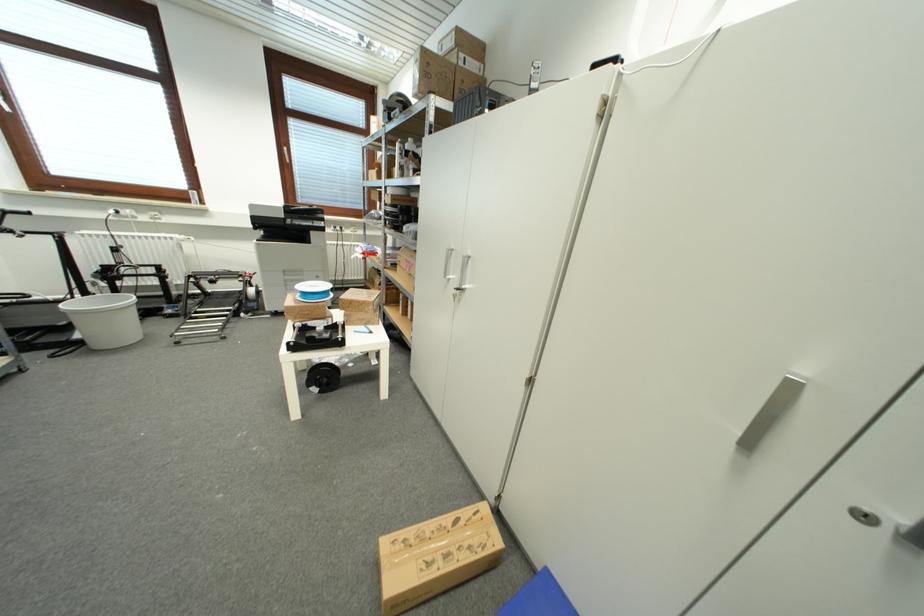
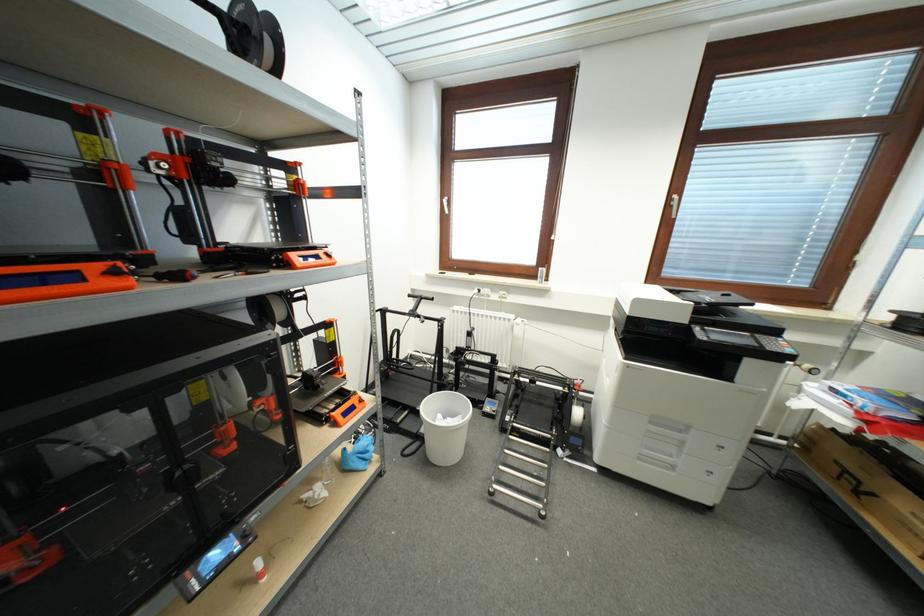
Where in the second image is the point corresponding to the point at 80,339 from the first image?

(427, 434)